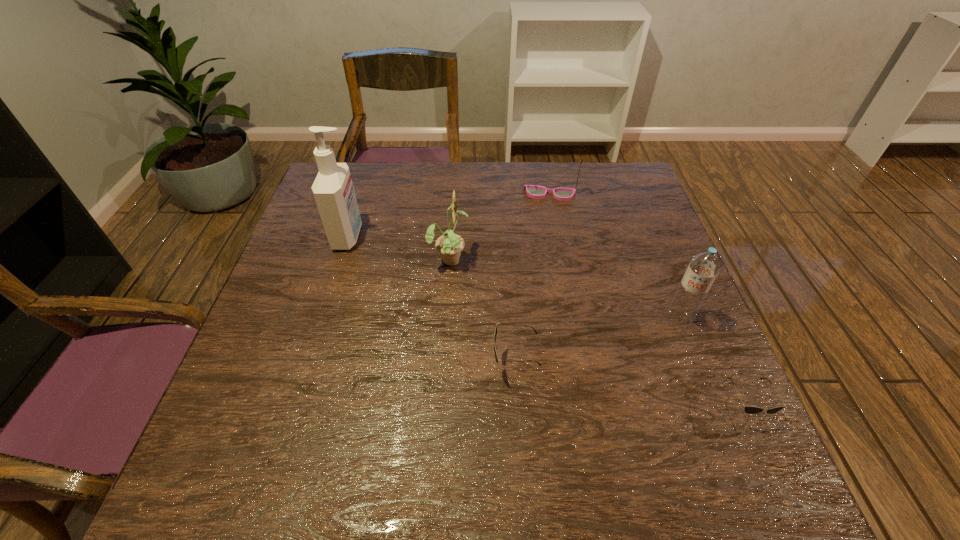
Locate an element on the screen. Image resolution: width=960 pixels, height=540 pixels. water bottle that is at the right edge is located at coordinates (703, 268).

The height and width of the screenshot is (540, 960). I want to click on object located at the near right corner, so click(748, 409).

Identify the location of vacant space at the far edge. (531, 183).

You are a GUI agent. You are given a task and a screenshot of the screen. Output one action in this format:
    pyautogui.click(x=<x>, y=<y>)
    Task: Click on the vacant space at the near edge of the desktop
    The height and width of the screenshot is (540, 960).
    Given the screenshot: What is the action you would take?
    pyautogui.click(x=378, y=431)

In order to click on free point at the left edge in this screenshot , I will do `click(265, 390)`.

I want to click on free space at the right edge, so click(680, 368).

I want to click on free space at the far right corner of the desktop, so click(631, 174).

This screenshot has width=960, height=540. I want to click on vacant point located between the sunflower and the tallest object, so coord(399,248).

You are a GUI agent. You are given a task and a screenshot of the screen. Output one action in this format:
    pyautogui.click(x=<x>, y=<y>)
    Task: Click on the free area in between the water bottle and the second shortest object
    The height and width of the screenshot is (540, 960).
    Given the screenshot: What is the action you would take?
    pyautogui.click(x=596, y=341)

Find the location of a particular element. The image size is (960, 540). vacant space in between the sunflower and the spectacles is located at coordinates (499, 226).